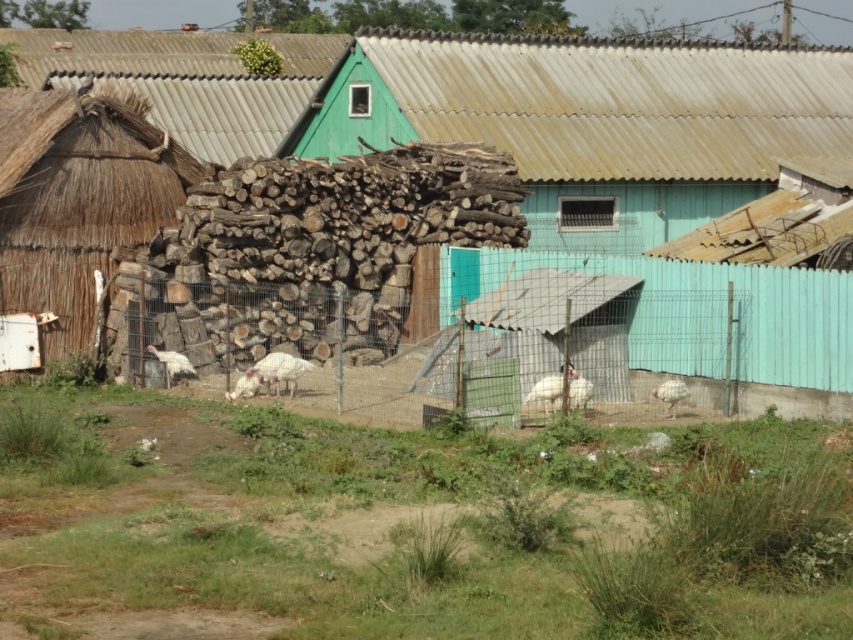
You are standing in the rural scene and want to place a small garden between the two points labeled point (184, 371) and point (233, 388). Based on their positions, which point is closer to you where you should start digging?

Point (184, 371) is closer to you than point (233, 388), so you should start digging at point (184, 371).

You are standing in the farmyard and want to approach both the white feathered turkey at lower left and the white feathered turkey at center. Which turkey should you approach first to reach the one closer to you?

You should approach the white feathered turkey at lower left first because it is closer to you than the white feathered turkey at center.

You are standing at the point labeled point (680, 337). What structure is directly in front of you?

The structure directly in front of you at point (680, 337) is the wire mesh fence at center.